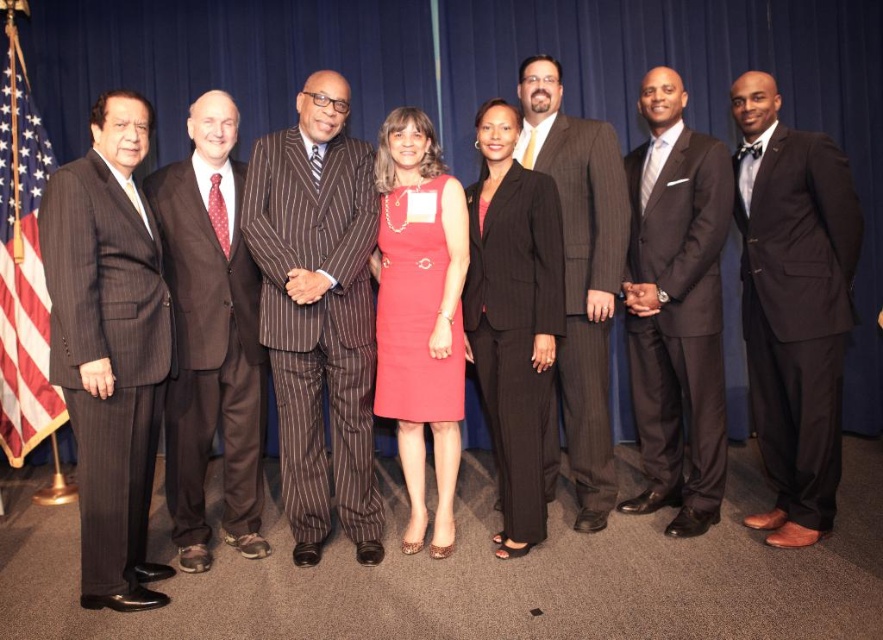
In the scene shown: You are a photographer at a formal event. You notice the dark gray pinstripe suit at left and the american flag at left. Which object is closer to the camera?

The dark gray pinstripe suit at left is in front of the american flag at left, so it is closer to the camera.

From the picture: You are a photographer adjusting the camera settings for a group photo. The scene includes a matte red dress at center and a matte pinstripe suit at center. Since you want to ensure both are in focus, which object should you set the focus on first to account for their sizes?

The matte red dress at center is smaller than the matte pinstripe suit at center, so you should focus on the smaller matte red dress at center first to ensure proper depth of field coverage for both.